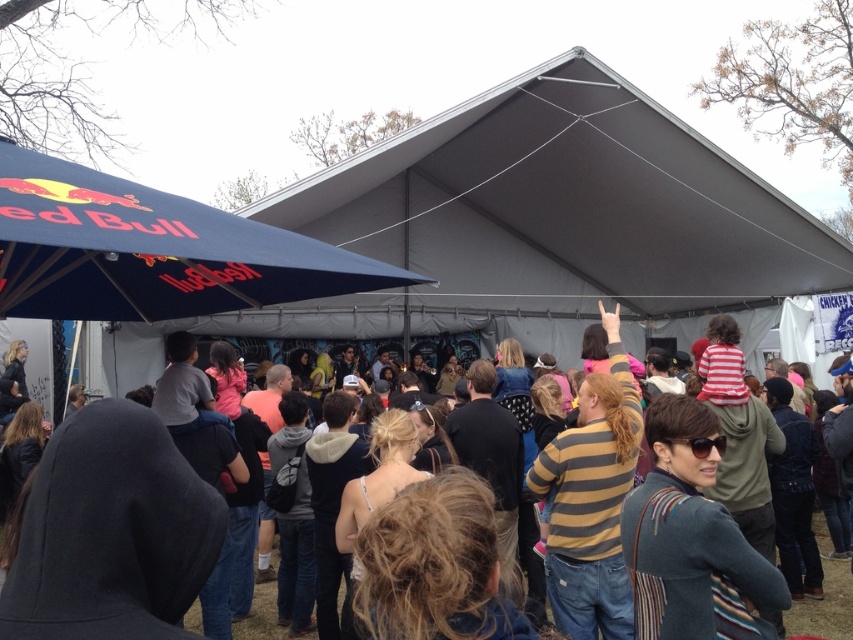
You are a photographer at the event and want to capture a photo of the striped sweater at center without the navy blue fabric canopy at upper left blocking it. Is this possible?

The navy blue fabric canopy at upper left is in front of the striped sweater at center, so it will block the view. Move to a position where the canopy is not between you and the sweater.

You are at the event and want to take a photo of the striped sweater at center without the navy blue fabric canopy at upper left blocking the view. Where should you position yourself relative to the canopy?

Move to the right side of the navy blue fabric canopy at upper left so that the striped sweater at center is visible without obstruction.

You are organizing a photo shoot and need to ensure that the navy blue fabric canopy at upper left and the striped sweater at center are both visible in the frame. Given their sizes, which object would require more space horizontally to capture fully in the photo?

The striped sweater at center requires more horizontal space because the navy blue fabric canopy at upper left is narrower than the striped sweater at center.